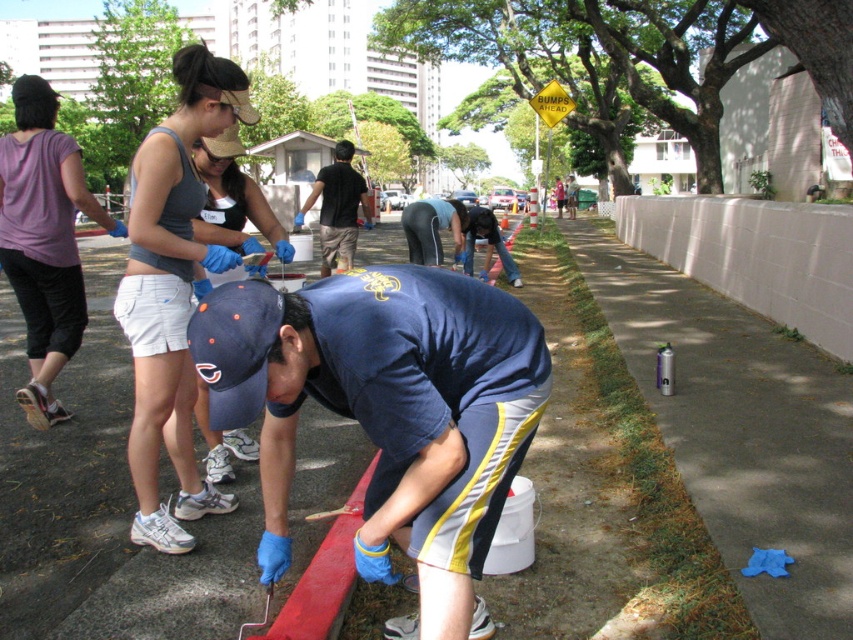
You are a photographer taking a picture of the community service activity. You notice the dark blue shirt at center and the blue denim jeans at center. Which clothing item is positioned higher on the person?

The dark blue shirt at center is above blue denim jeans at center, so the dark blue shirt at center is positioned higher.

You are standing at the point labeled as point (335, 160) and want to walk towards the point labeled as point (337, 596). Which direction should you face to move towards your destination?

You should face forward because point (337, 596) is in front of point (335, 160).

You are a photographer standing at the sidewalk edge trying to capture a clear photo of both the blue fabric cap at center and the dark blue shirt at center. Which object will appear larger in your photo?

The blue fabric cap at center will appear larger in the photo because it is closer to the viewer than the dark blue shirt at center.